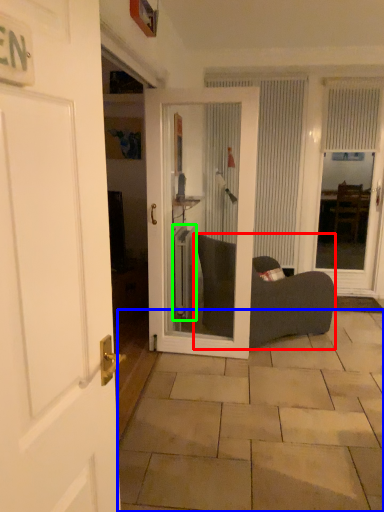
Question: Which is nearer to the furniture (highlighted by a red box)? tile (highlighted by a blue box) or radiator (highlighted by a green box).

Choices:
 (A) tile
 (B) radiator

Answer: (B)